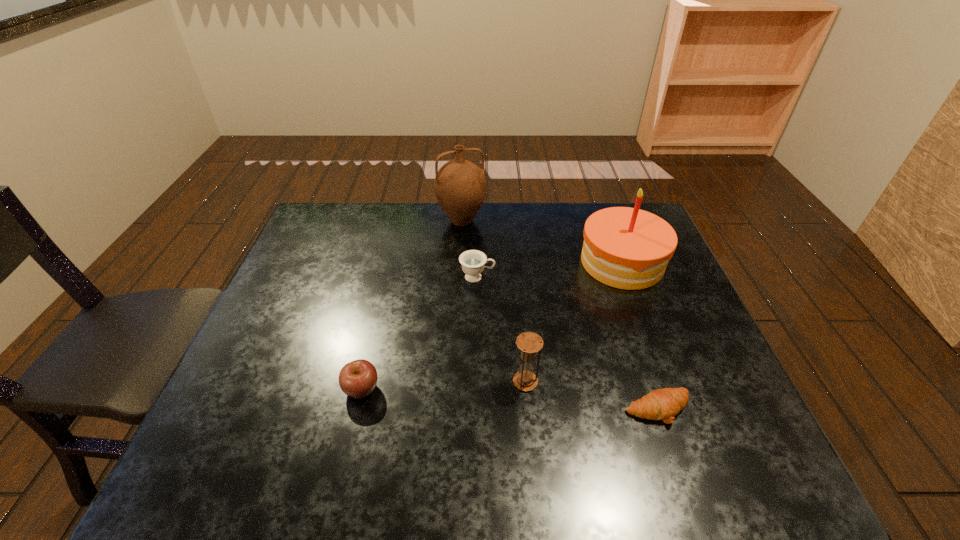
Where is `pitcher`? This screenshot has width=960, height=540. pitcher is located at coordinates (460, 185).

The height and width of the screenshot is (540, 960). Identify the location of birthday cake. (628, 248).

Locate an element on the screen. Image resolution: width=960 pixels, height=540 pixels. hourglass is located at coordinates (529, 343).

Where is `the third object from right to left`? Image resolution: width=960 pixels, height=540 pixels. the third object from right to left is located at coordinates [529, 343].

I want to click on teacup, so click(x=473, y=262).

I want to click on apple, so click(x=357, y=379).

Identify the location of the shortest object. The image size is (960, 540). (663, 404).

The width and height of the screenshot is (960, 540). Find the location of `vacant space located on the left of the pitcher`. vacant space located on the left of the pitcher is located at coordinates (422, 220).

The width and height of the screenshot is (960, 540). What are the coordinates of `vacant space located 0.200m on the front of the birthday cake` in the screenshot? It's located at (654, 347).

This screenshot has height=540, width=960. Identify the location of free point located on the left of the fourth shortest object. (397, 382).